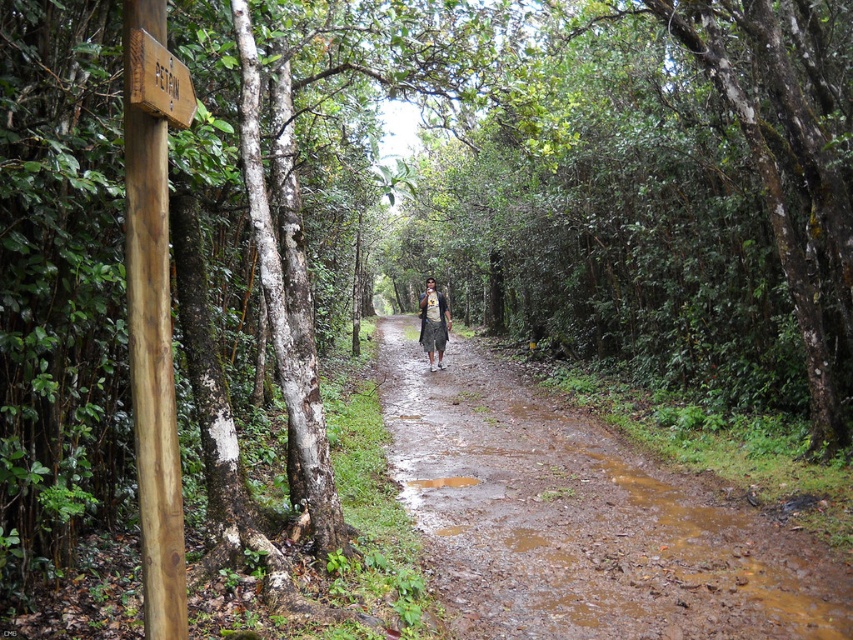
Can you confirm if muddy dirt path at center is positioned above camouflage fabric shirt at center?

Incorrect, muddy dirt path at center is not positioned above camouflage fabric shirt at center.

Between muddy dirt path at center and camouflage fabric shirt at center, which one has less height?

Standing shorter between the two is camouflage fabric shirt at center.

Where is `muddy dirt path at center`? muddy dirt path at center is located at coordinates (579, 518).

Is muddy dirt path at center positioned before brown wooden signpost at left?

No, it is not.

Does muddy dirt path at center have a smaller size compared to brown wooden signpost at left?

No, muddy dirt path at center is not smaller than brown wooden signpost at left.

Is point (471, 600) farther from viewer compared to point (129, 268)?

Yes.

The width and height of the screenshot is (853, 640). What are the coordinates of `muddy dirt path at center` in the screenshot? It's located at (579, 518).

Does brown wooden signpost at left appear under camouflage fabric shirt at center?

Indeed, brown wooden signpost at left is positioned under camouflage fabric shirt at center.

Is point (155, 227) in front of point (436, 305)?

That is True.

At what (x,y) coordinates should I click in order to perform the action: click on brown wooden signpost at left. Please return your answer as a coordinate pair (x, y). The image size is (853, 640). Looking at the image, I should click on (154, 372).